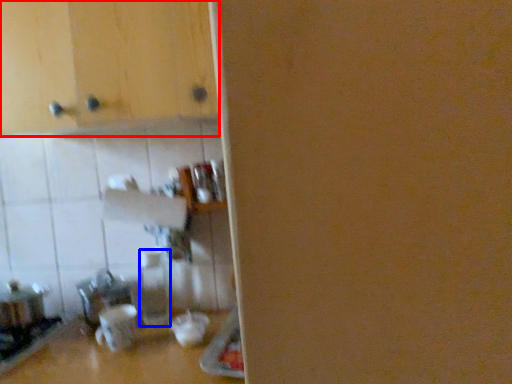
Question: Which object appears closest to the camera in this image, cabinetry (highlighted by a red box) or bottle (highlighted by a blue box)?

Choices:
 (A) cabinetry
 (B) bottle

Answer: (A)